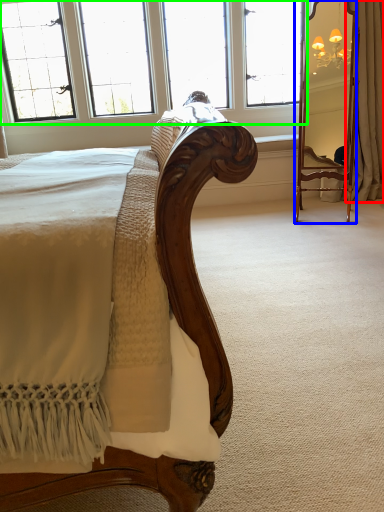
Question: Which object is the closest to the curtain (highlighted by a red box)? Choose among these: mirror (highlighted by a blue box) or window (highlighted by a green box).

Choices:
 (A) mirror
 (B) window

Answer: (A)